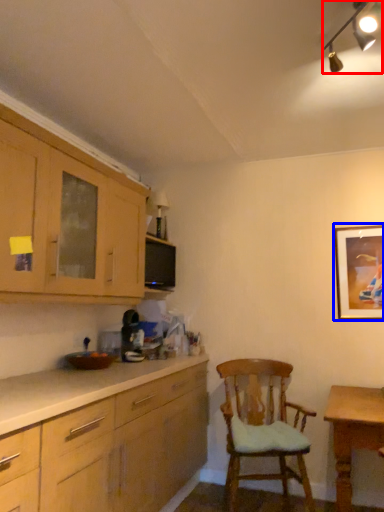
Question: Which of the following is the closest to the observer, light fixture (highlighted by a red box) or picture frame (highlighted by a blue box)?

Choices:
 (A) light fixture
 (B) picture frame

Answer: (A)